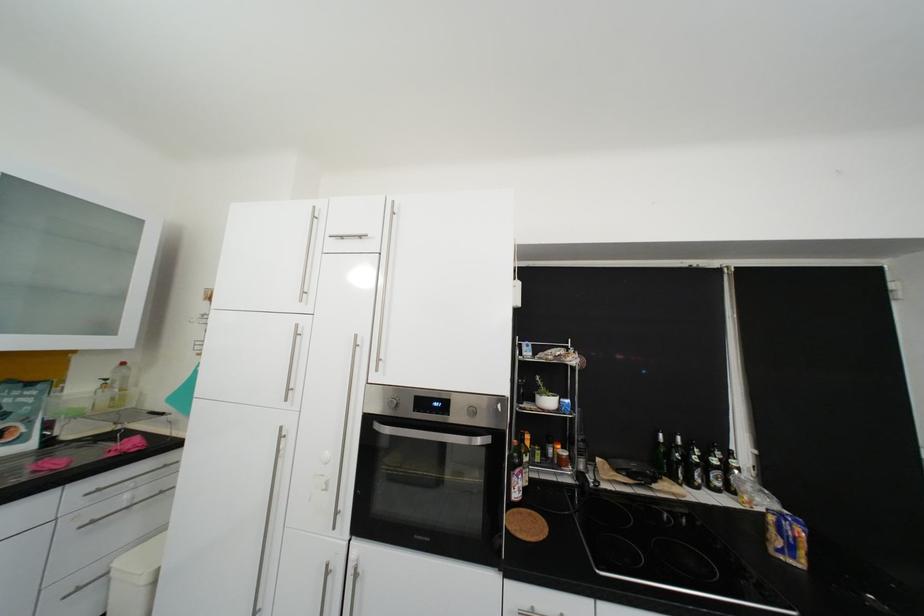
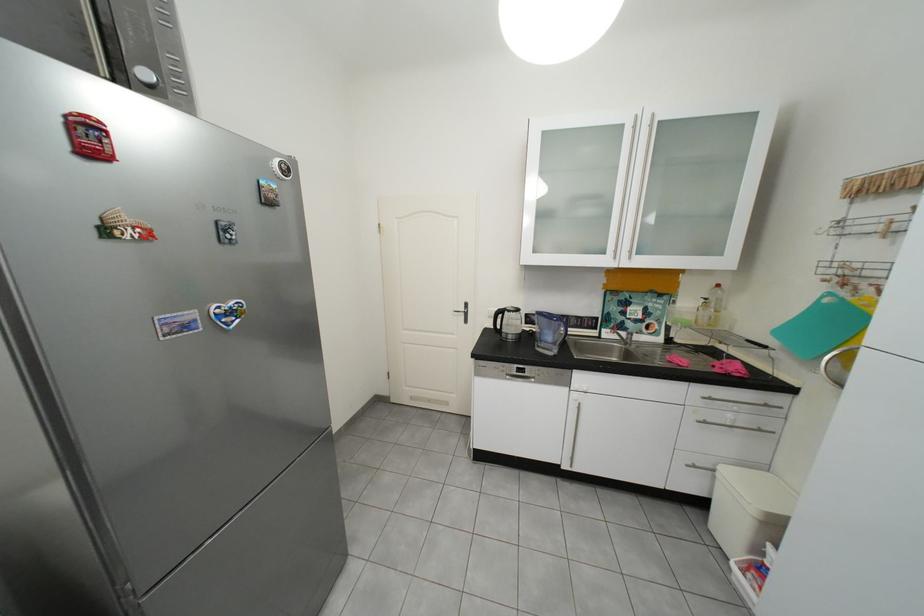
Find the pixel in the second image that matches point (111, 492) in the first image.

(723, 400)